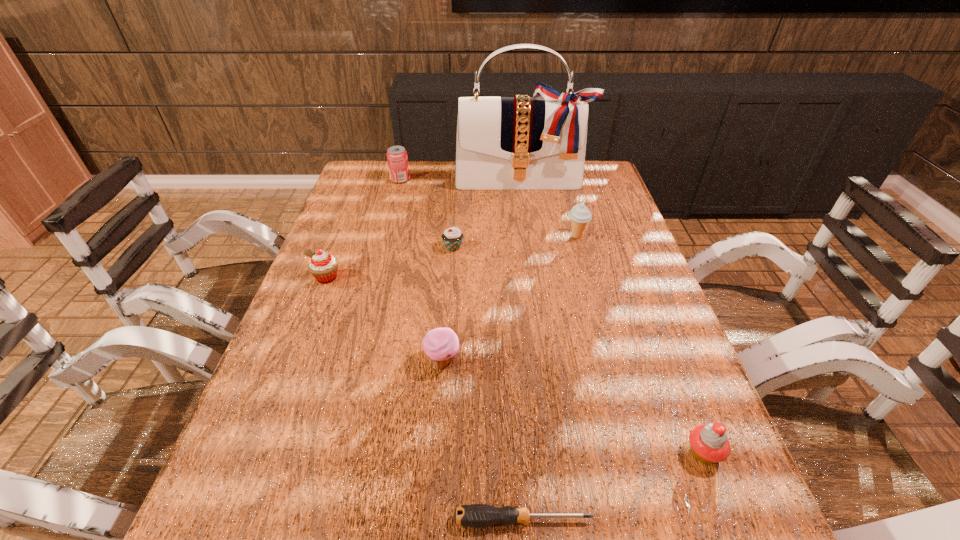
Where is `soda can that is positioned at the far edge`? Image resolution: width=960 pixels, height=540 pixels. soda can that is positioned at the far edge is located at coordinates (397, 159).

Locate an element on the screen. Image resolution: width=960 pixels, height=540 pixels. object that is at the near edge is located at coordinates (475, 515).

The height and width of the screenshot is (540, 960). I want to click on soda can present at the left edge, so click(397, 159).

The height and width of the screenshot is (540, 960). Find the location of `cupcake that is at the left edge`. cupcake that is at the left edge is located at coordinates (323, 266).

Where is `satchel at the right edge`? The height and width of the screenshot is (540, 960). satchel at the right edge is located at coordinates (502, 143).

You are a GUI agent. You are given a task and a screenshot of the screen. Output one action in this format:
    pyautogui.click(x=<x>, y=<y>)
    Task: Click on the icecream that is positioned at the right edge
    This screenshot has height=540, width=960.
    Given the screenshot: What is the action you would take?
    pyautogui.click(x=580, y=215)

The width and height of the screenshot is (960, 540). Find the location of `cupcake situated at the right edge`. cupcake situated at the right edge is located at coordinates (709, 443).

Where is `object located at the far left corner`? The image size is (960, 540). object located at the far left corner is located at coordinates (397, 159).

Find the location of a particular element. The image size is (960, 540). object that is positioned at the far right corner is located at coordinates (502, 143).

I want to click on vacant space at the far edge, so click(454, 168).